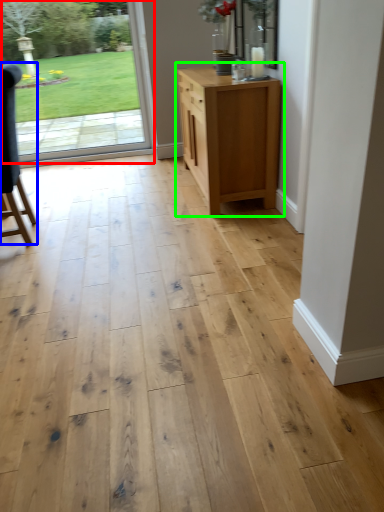
Question: Considering the real-world distances, which object is farthest from door (highlighted by a red box)? chair (highlighted by a blue box) or chest of drawers (highlighted by a green box)?

Choices:
 (A) chair
 (B) chest of drawers

Answer: (B)